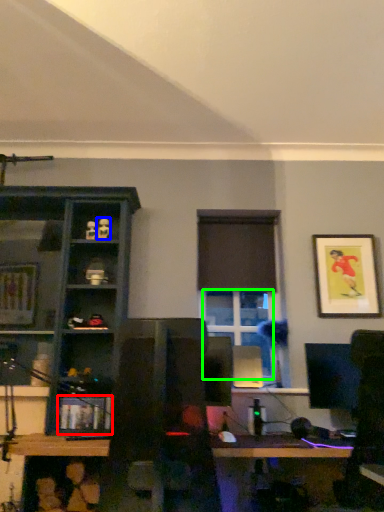
Question: Which is farther away from shelf (highlighted by a red box)? toy (highlighted by a blue box) or window (highlighted by a green box)?

Choices:
 (A) toy
 (B) window

Answer: (A)